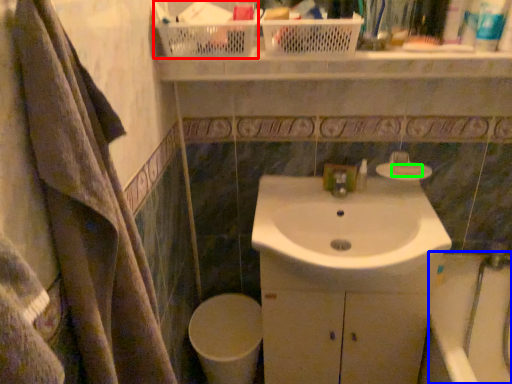
Question: Considering the real-world distances, which object is closest to basket (highlighted by a red box)? bath (highlighted by a blue box) or soap (highlighted by a green box).

Choices:
 (A) bath
 (B) soap

Answer: (B)